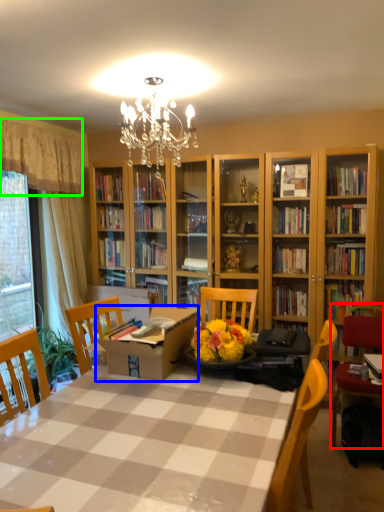
Question: Based on their relative distances, which object is nearer to chair (highlighted by a red box)? Choose from cardboard box (highlighted by a blue box) and curtain (highlighted by a green box).

Choices:
 (A) cardboard box
 (B) curtain

Answer: (A)